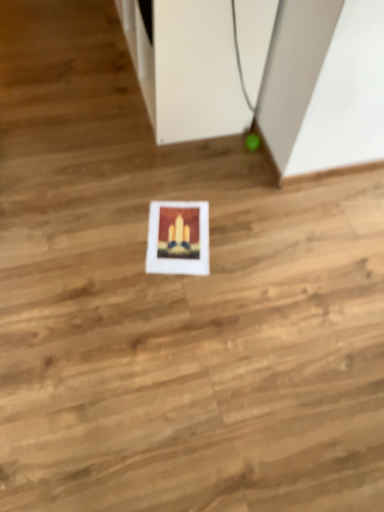
Identify the location of free space on the front side of white glossy cabinet at upper center. This screenshot has height=512, width=384. (143, 177).